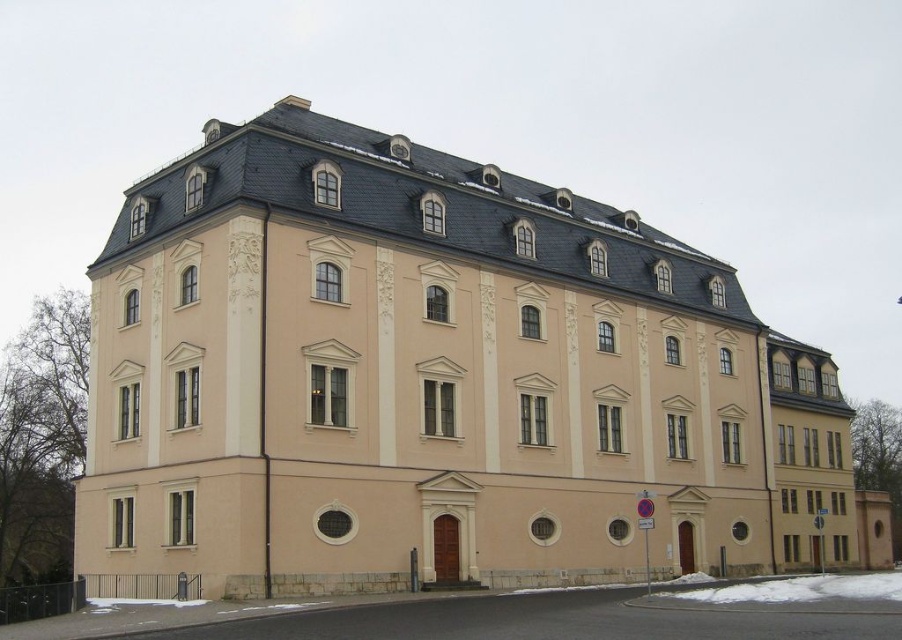
Question: Is beige stone building at center to the right of white powdery snow at lower center from the viewer's perspective?

Choices:
 (A) no
 (B) yes

Answer: (A)

Question: Does beige stone building at center have a greater width compared to white powdery snow at lower center?

Choices:
 (A) no
 (B) yes

Answer: (B)

Question: Which of the following is the farthest from the observer?

Choices:
 (A) white powdery snow at lower center
 (B) beige stone building at center

Answer: (B)

Question: Which object appears closest to the camera in this image?

Choices:
 (A) beige stone building at center
 (B) white powdery snow at lower center

Answer: (B)

Question: Can you confirm if beige stone building at center is wider than white powdery snow at lower center?

Choices:
 (A) no
 (B) yes

Answer: (B)